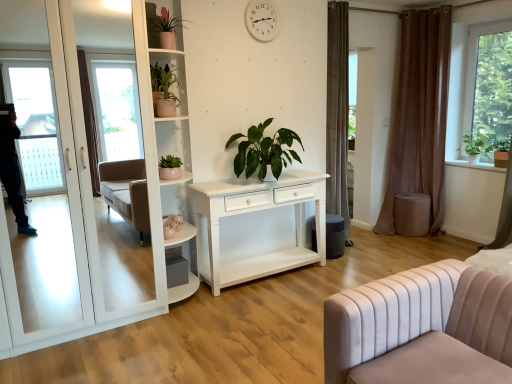
I want to click on free spot in front of white glossy screen door at left, so [x=81, y=361].